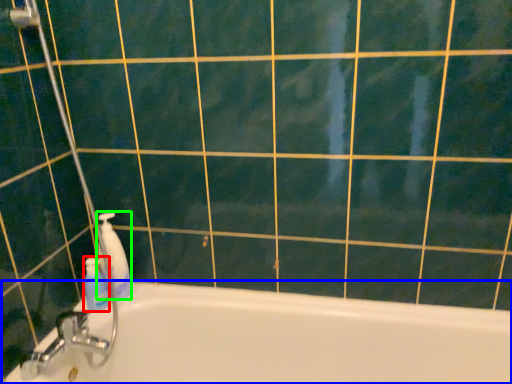
Question: Considering the real-world distances, which object is farthest from cleaning product (highlighted by a red box)? bathtub (highlighted by a blue box) or cleaning product (highlighted by a green box)?

Choices:
 (A) bathtub
 (B) cleaning product

Answer: (A)